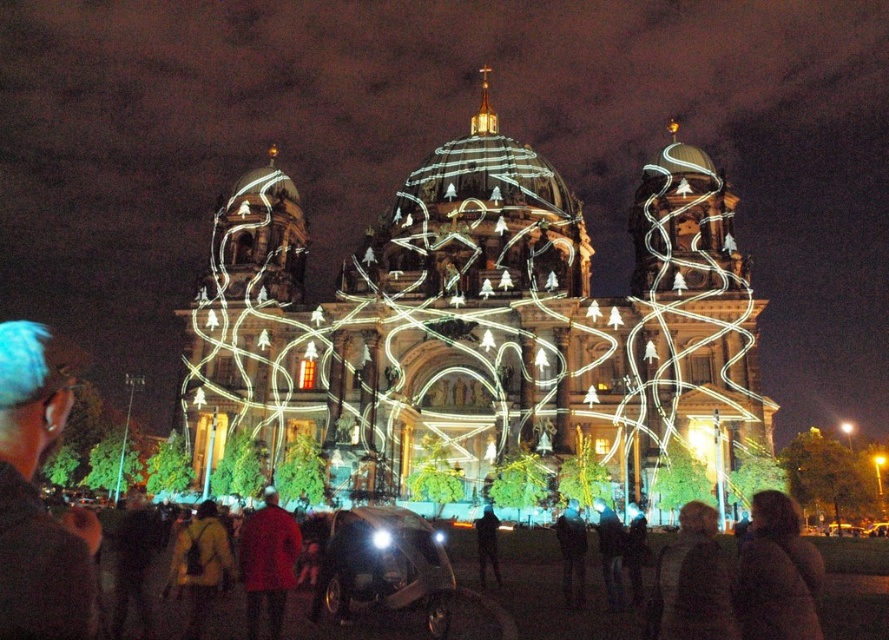
Can you confirm if brown fuzzy coat at lower right is taller than dark blue fabric jacket at center?

Yes.

Does brown fuzzy coat at lower right have a smaller size compared to dark blue fabric jacket at center?

Incorrect, brown fuzzy coat at lower right is not smaller in size than dark blue fabric jacket at center.

Is point (789, 592) less distant than point (558, 541)?

Yes, it is.

Find the location of a particular element. The image size is (889, 640). brown fuzzy coat at lower right is located at coordinates (777, 573).

Can you confirm if brown fuzzy coat at lower right is taller than red matte coat at center?

Correct, brown fuzzy coat at lower right is much taller as red matte coat at center.

Is brown fuzzy coat at lower right thinner than red matte coat at center?

No.

Find the location of a particular element. This screenshot has height=640, width=889. brown fuzzy coat at lower right is located at coordinates (777, 573).

The image size is (889, 640). I want to click on brown fuzzy coat at lower right, so click(777, 573).

Between point (683, 624) and point (573, 541), which one is positioned behind?

Point (573, 541)

Is point (690, 634) behind point (578, 600)?

No, (690, 634) is in front of (578, 600).

The height and width of the screenshot is (640, 889). What are the coordinates of `dark brown leather jacket at lower right` in the screenshot? It's located at (694, 580).